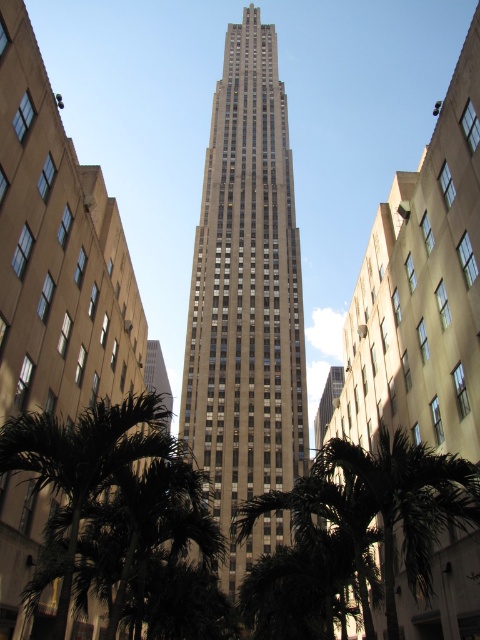
Between gray stone skyscraper at center and green leafy palm tree at center, which one is positioned lower?

green leafy palm tree at center is below.

Who is more forward, (244, 54) or (439, 515)?

Positioned in front is point (439, 515).

Is point (228, 333) farther from camera compared to point (363, 460)?

Yes, it is.

Identify the location of gray stone skyscraper at center. (245, 289).

Is point (231, 564) closer to viewer compared to point (118, 452)?

That is False.

Between gray stone skyscraper at center and green leafy palm tree at lower left, which one is positioned higher?

gray stone skyscraper at center

This screenshot has height=640, width=480. Describe the element at coordinates (245, 289) in the screenshot. I see `gray stone skyscraper at center` at that location.

The width and height of the screenshot is (480, 640). I want to click on gray stone skyscraper at center, so click(245, 289).

Is green leafy palm tree at center further to camera compared to green leafy palm tree at lower left?

Yes, green leafy palm tree at center is behind green leafy palm tree at lower left.

Which is behind, point (373, 476) or point (103, 413)?

Positioned behind is point (103, 413).

Is point (462, 515) closer to viewer compared to point (144, 456)?

Yes, it is.

This screenshot has height=640, width=480. I want to click on green leafy palm tree at center, so click(x=408, y=502).